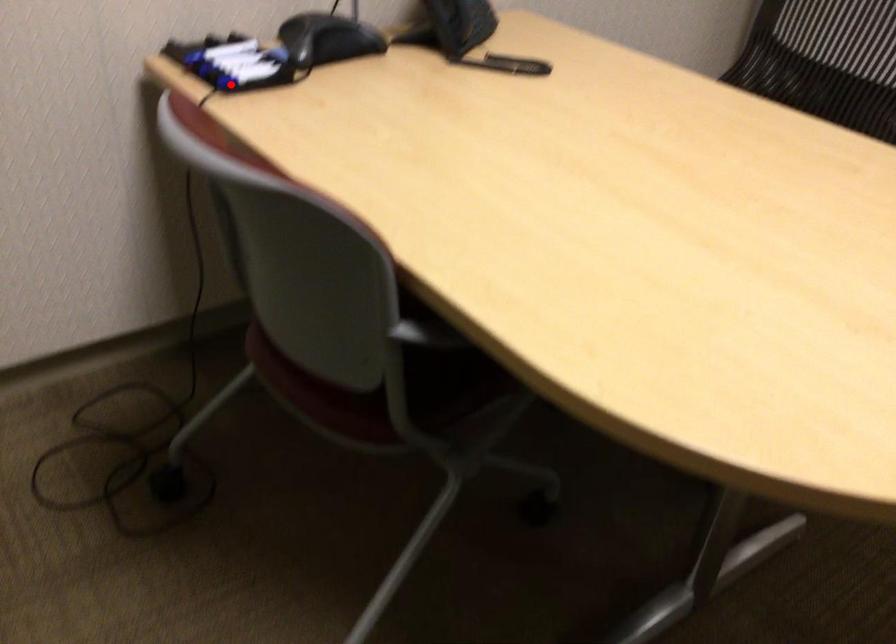
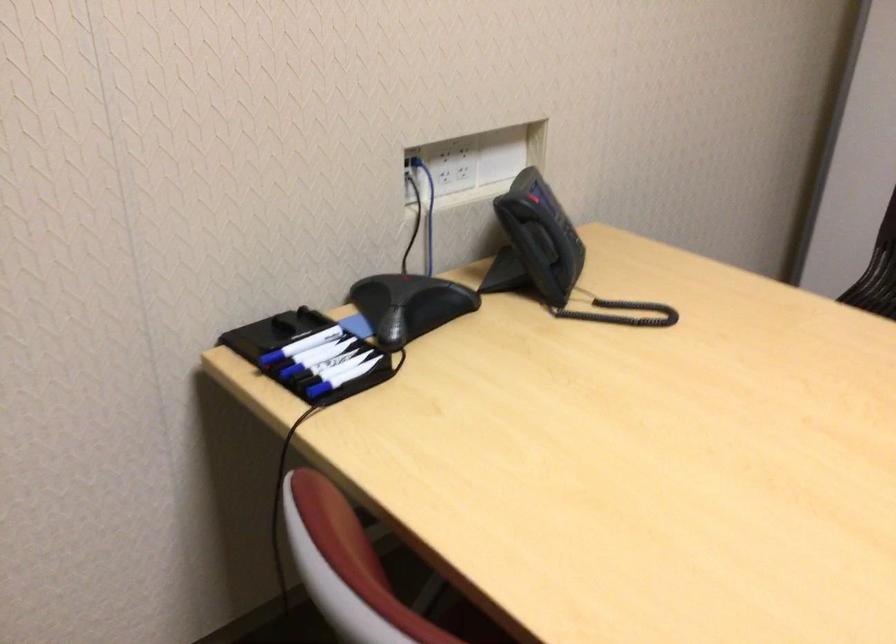
Where in the second image is the point corresponding to the highlighted location from the first image?

(320, 393)